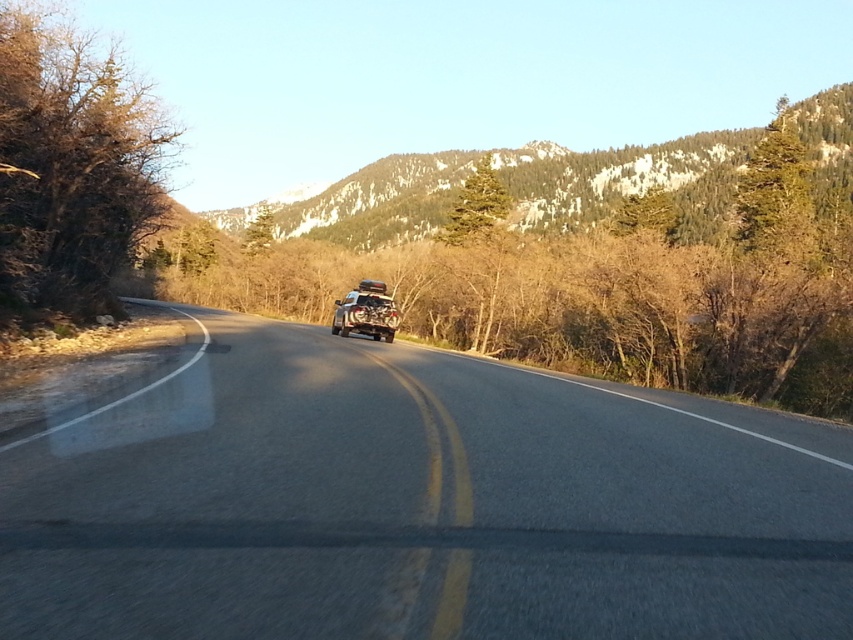
Question: Is green textured mountain at upper center to the right of metallic silver jeep at center from the viewer's perspective?

Choices:
 (A) no
 (B) yes

Answer: (B)

Question: From the image, what is the correct spatial relationship of green textured mountain at upper center in relation to metallic silver jeep at center?

Choices:
 (A) above
 (B) below

Answer: (A)

Question: Estimate the real-world distances between objects in this image. Which object is farther from the asphalt road at center?

Choices:
 (A) green textured mountain at upper center
 (B) metallic silver jeep at center

Answer: (A)

Question: Which point is closer to the camera taking this photo?

Choices:
 (A) (360, 317)
 (B) (706, 196)
 (C) (364, 468)

Answer: (C)

Question: Which point is farther to the camera?

Choices:
 (A) (395, 556)
 (B) (538, 182)
 (C) (378, 304)

Answer: (B)

Question: Is asphalt road at center smaller than metallic silver jeep at center?

Choices:
 (A) yes
 (B) no

Answer: (B)